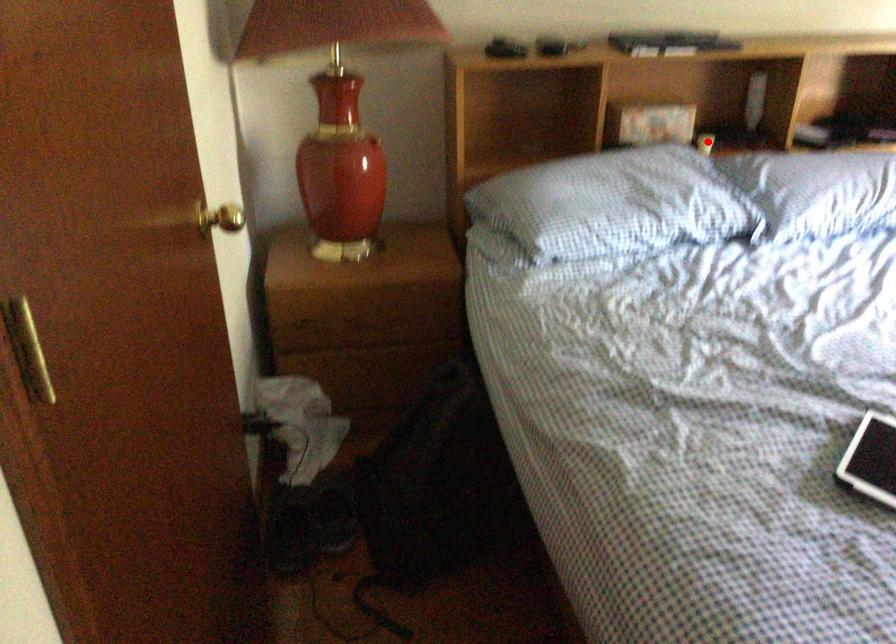
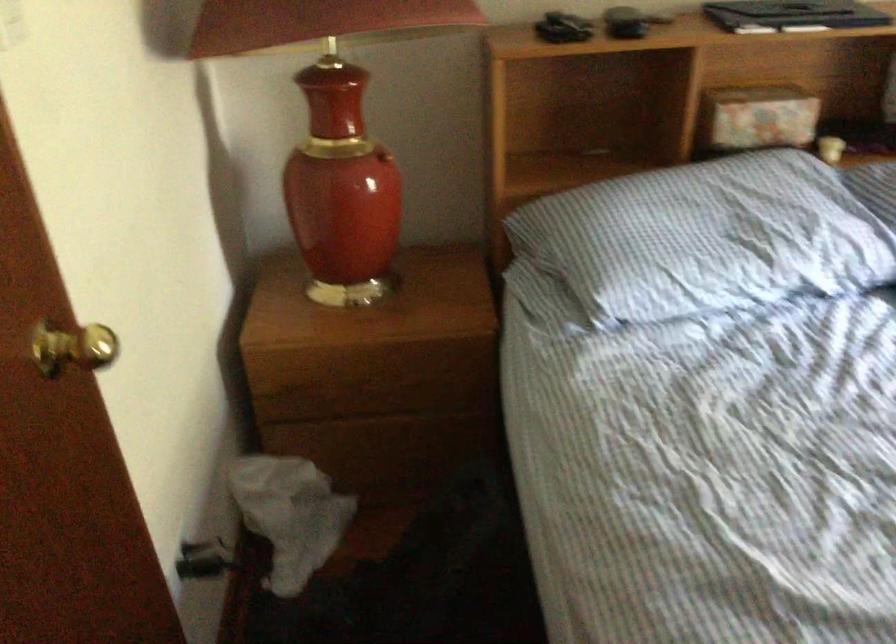
Question: I am providing you with two images of the same scene from different viewpoints. Image1 has a red point marked. In image2, the corresponding 3D location appears at what relative position? Reply with the corresponding letter.

Choices:
 (A) Closer
 (B) Farther

Answer: (A)